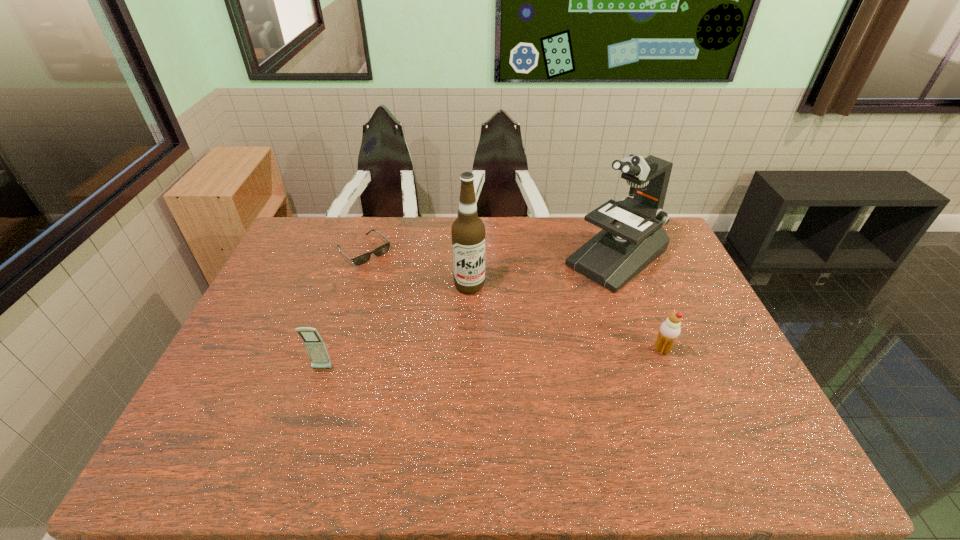
This screenshot has width=960, height=540. What are the coordinates of `microscope that is at the right edge` in the screenshot? It's located at (632, 237).

Locate an element on the screen. The width and height of the screenshot is (960, 540). object that is at the far right corner is located at coordinates (632, 237).

In order to click on free region at the far edge of the desktop in this screenshot , I will do `click(502, 252)`.

Where is `free region at the near edge of the desktop`? This screenshot has width=960, height=540. free region at the near edge of the desktop is located at coordinates (542, 427).

You are a GUI agent. You are given a task and a screenshot of the screen. Output one action in this format:
    pyautogui.click(x=<x>, y=<y>)
    Task: Click on the vacant space at the right edge
    The height and width of the screenshot is (540, 960).
    Given the screenshot: What is the action you would take?
    pyautogui.click(x=673, y=284)

The width and height of the screenshot is (960, 540). Find the location of `vacant space at the far left corner of the desktop`. vacant space at the far left corner of the desktop is located at coordinates (319, 244).

This screenshot has width=960, height=540. I want to click on vacant point located between the alcohol and the icecream, so click(x=565, y=318).

The image size is (960, 540). What are the coordinates of `unoccupied position between the third object from left to right and the microscope` in the screenshot? It's located at (543, 272).

The height and width of the screenshot is (540, 960). I want to click on vacant area between the microscope and the fourth farthest object, so click(x=639, y=304).

At what (x,y) coordinates should I click in order to perform the action: click on free space between the alcohol and the icecream. Please return your answer as a coordinate pair (x, y). Looking at the image, I should click on (565, 318).